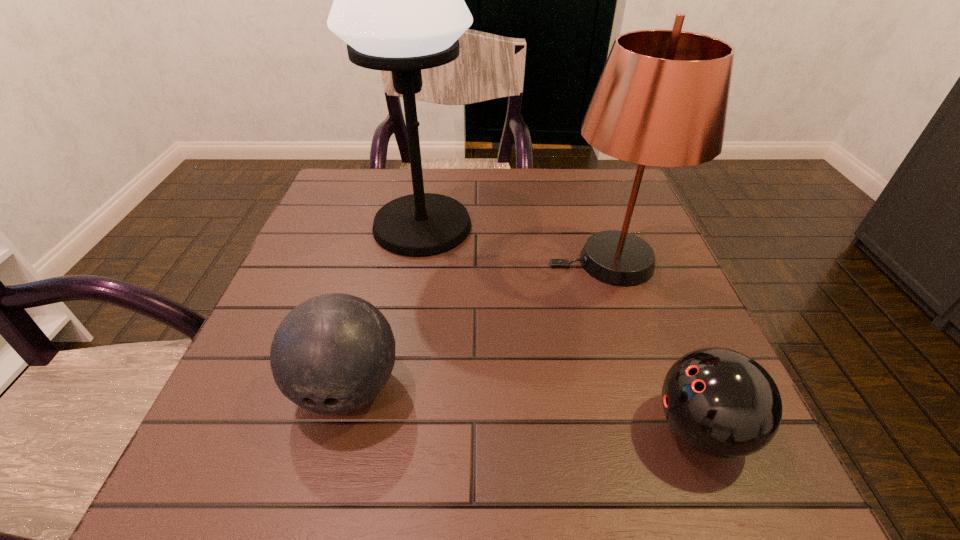
Where is `object that is positioned at the near right corner`? Image resolution: width=960 pixels, height=540 pixels. object that is positioned at the near right corner is located at coordinates (719, 401).

Locate an element on the screen. free space at the far edge is located at coordinates (542, 176).

Where is `vacant space at the near edge`? Image resolution: width=960 pixels, height=540 pixels. vacant space at the near edge is located at coordinates (633, 468).

Image resolution: width=960 pixels, height=540 pixels. In order to click on vacant space at the left edge in this screenshot , I will do `click(285, 406)`.

Locate an element on the screen. The image size is (960, 540). vacant space at the right edge of the desktop is located at coordinates (592, 234).

Where is `vacant space at the far left corner`? vacant space at the far left corner is located at coordinates (377, 171).

This screenshot has width=960, height=540. In the image, there is a desktop. In order to click on vacant region at the far right corner in this screenshot , I will do `click(601, 200)`.

Find the location of a particular element. The width and height of the screenshot is (960, 540). free space at the near right corner is located at coordinates (741, 481).

You are a GUI agent. You are given a task and a screenshot of the screen. Output one action in this format:
    pyautogui.click(x=<x>, y=<y>)
    Task: Click on the vacant area between the shortest object and the lampshade
    The height and width of the screenshot is (540, 960).
    Given the screenshot: What is the action you would take?
    pyautogui.click(x=656, y=346)

Image resolution: width=960 pixels, height=540 pixels. What are the coordinates of `free space between the shorter bowling ball and the third tallest object` in the screenshot? It's located at (524, 408).